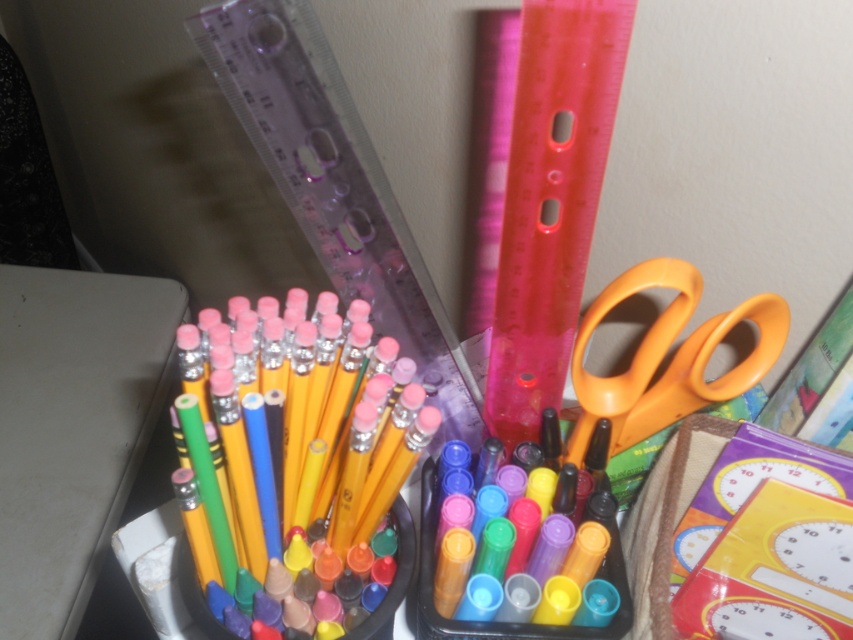
Does orange plastic scissors at right appear on the left side of translucent plastic markers at center?

Incorrect, orange plastic scissors at right is not on the left side of translucent plastic markers at center.

Measure the distance between point (737, 387) and camera.

The distance of point (737, 387) from camera is 19.86 inches.

Measure the distance between point [753,307] and camera.

The distance of point [753,307] from camera is 18.60 inches.

Where is `orange plastic scissors at right`? The height and width of the screenshot is (640, 853). orange plastic scissors at right is located at coordinates (670, 360).

From the picture: Who is higher up, yellow matte pencils at center or translucent plastic markers at center?

yellow matte pencils at center is higher up.

Does point (190, 600) lie behind point (421, 524)?

No, it is in front of (421, 524).

I want to click on yellow matte pencils at center, so 244,476.

Does point (573, 376) come farther from viewer compared to point (262, 484)?

Yes, it is behind point (262, 484).

Can you confirm if orange plastic scissors at right is shorter than yellow matte pencils at center?

Yes.

Is point (577, 451) farther from viewer compared to point (401, 509)?

Yes, it is behind point (401, 509).

This screenshot has width=853, height=640. In order to click on orange plastic scissors at right in this screenshot , I will do `click(670, 360)`.